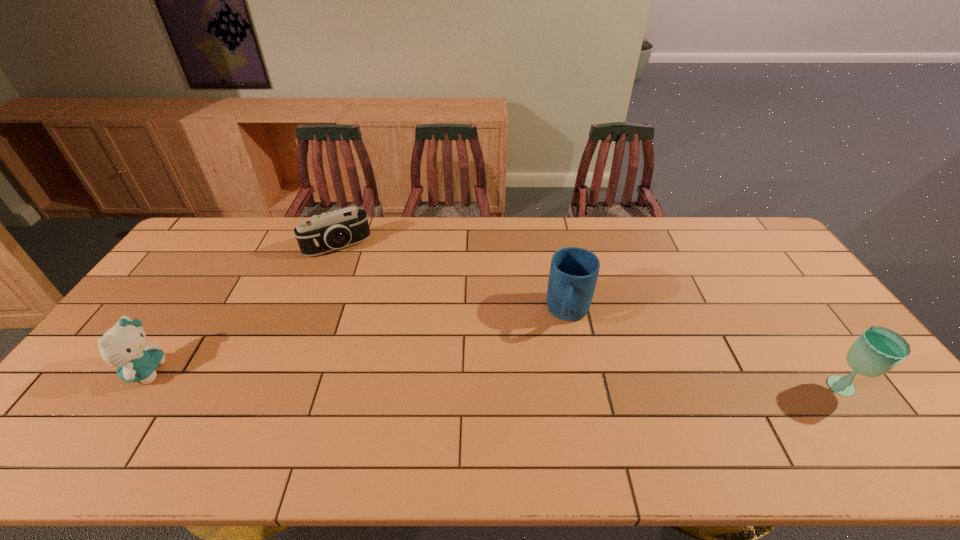
Where is `vacant spot on the desktop that is between the kitten and the glass and is positioned on the front lens of the camera`? vacant spot on the desktop that is between the kitten and the glass and is positioned on the front lens of the camera is located at coordinates (402, 377).

Find the location of a particular element. The width and height of the screenshot is (960, 540). vacant space on the desktop that is between the kitten and the rightmost object and is positioned on the side of the mug with the handle is located at coordinates (552, 382).